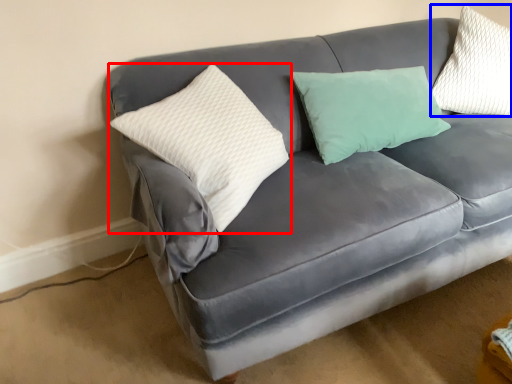
Question: Which point is closer to the camera, pillow (highlighted by a red box) or pillow (highlighted by a blue box)?

Choices:
 (A) pillow
 (B) pillow

Answer: (A)